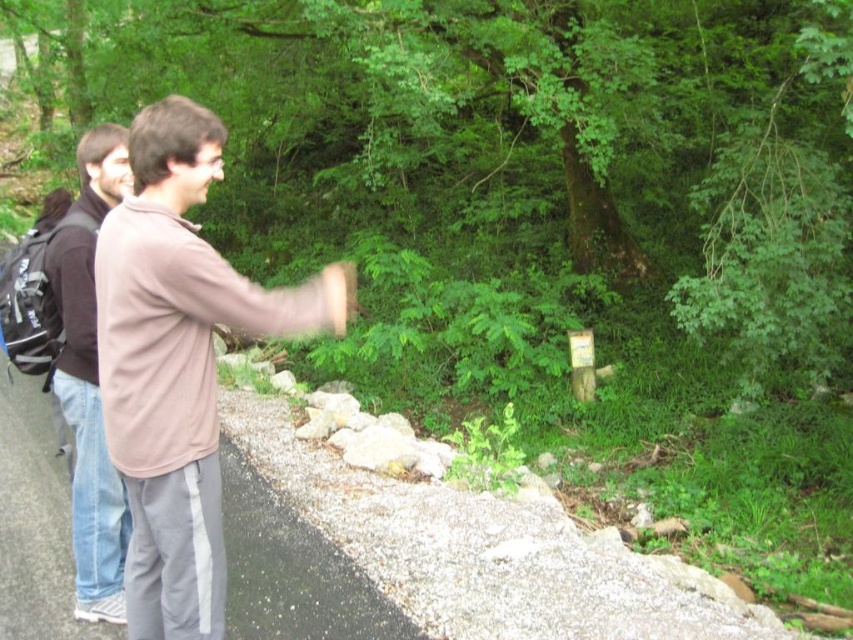
Question: Which point is closer to the camera?

Choices:
 (A) light brown cotton shirt at center
 (B) brown cotton hoodie at left

Answer: (A)

Question: Does light brown cotton shirt at center have a larger size compared to brown cotton hoodie at left?

Choices:
 (A) no
 (B) yes

Answer: (B)

Question: Observing the image, what is the correct spatial positioning of light brown cotton shirt at center in reference to brown cotton hoodie at left?

Choices:
 (A) above
 (B) below

Answer: (A)

Question: Which of the following is the closest to the observer?

Choices:
 (A) (216, 621)
 (B) (114, 470)

Answer: (A)

Question: Can you confirm if light brown cotton shirt at center is smaller than brown cotton hoodie at left?

Choices:
 (A) no
 (B) yes

Answer: (A)